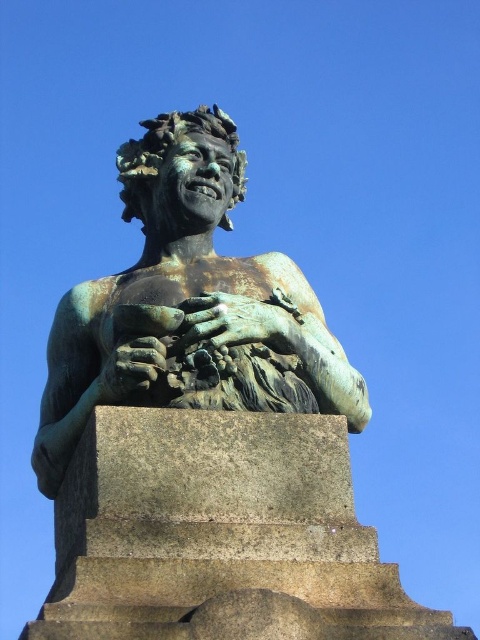
Question: Which point is closer to the camera?

Choices:
 (A) bronze/greenish patina hand at center
 (B) bronze/green patina hand at center

Answer: (A)

Question: Which of the following is the farthest from the observer?

Choices:
 (A) green patina bronze statue at center
 (B) bronze/greenish patina hand at center

Answer: (A)

Question: Where is green patina bronze statue at center located in relation to bronze/green patina hand at center in the image?

Choices:
 (A) above
 (B) below

Answer: (B)

Question: In this image, where is green patina bronze statue at center located relative to bronze/green patina hand at center?

Choices:
 (A) right
 (B) left

Answer: (B)

Question: Is green patina bronze statue at center positioned at the back of bronze/greenish patina hand at center?

Choices:
 (A) yes
 (B) no

Answer: (A)

Question: Which point appears farthest from the camera in this image?

Choices:
 (A) (227, 314)
 (B) (297, 397)
 (C) (156, 369)

Answer: (B)